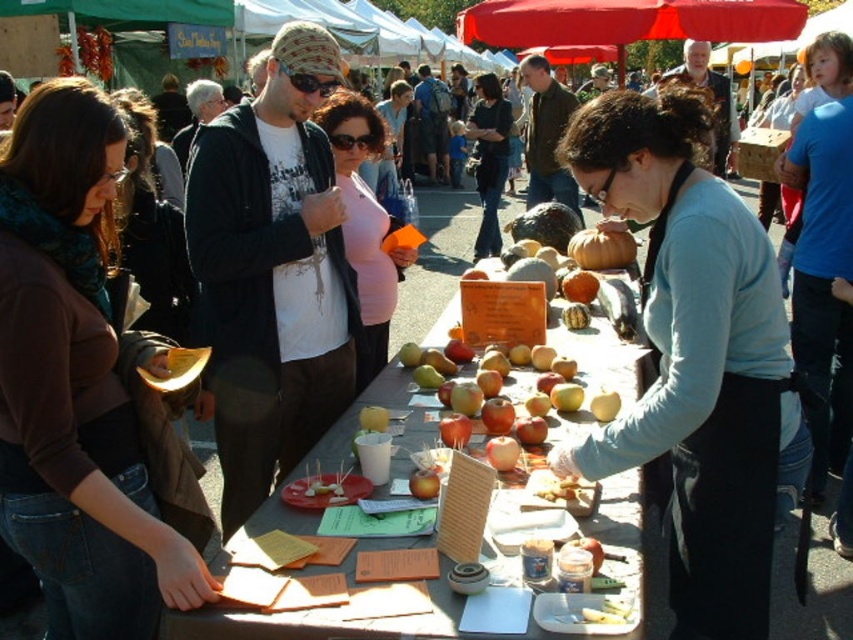
Question: Which object is closer to the camera taking this photo?

Choices:
 (A) orange matte pumpkin at center
 (B) matte wooden table at center

Answer: (B)

Question: Does brown fabric scarf at upper left lie in front of orange matte pumpkin at center?

Choices:
 (A) yes
 (B) no

Answer: (A)

Question: Which point appears closest to the camera in this image?

Choices:
 (A) (65, 394)
 (B) (769, 428)

Answer: (A)

Question: Among these points, which one is nearest to the camera?

Choices:
 (A) (180, 632)
 (B) (585, 243)
 (C) (701, 339)
 (D) (44, 227)

Answer: (A)

Question: Does light blue fabric apron at center have a larger size compared to orange matte pumpkin at center?

Choices:
 (A) no
 (B) yes

Answer: (B)

Question: Can you confirm if light blue fabric apron at center is positioned to the right of brown fabric scarf at upper left?

Choices:
 (A) no
 (B) yes

Answer: (B)